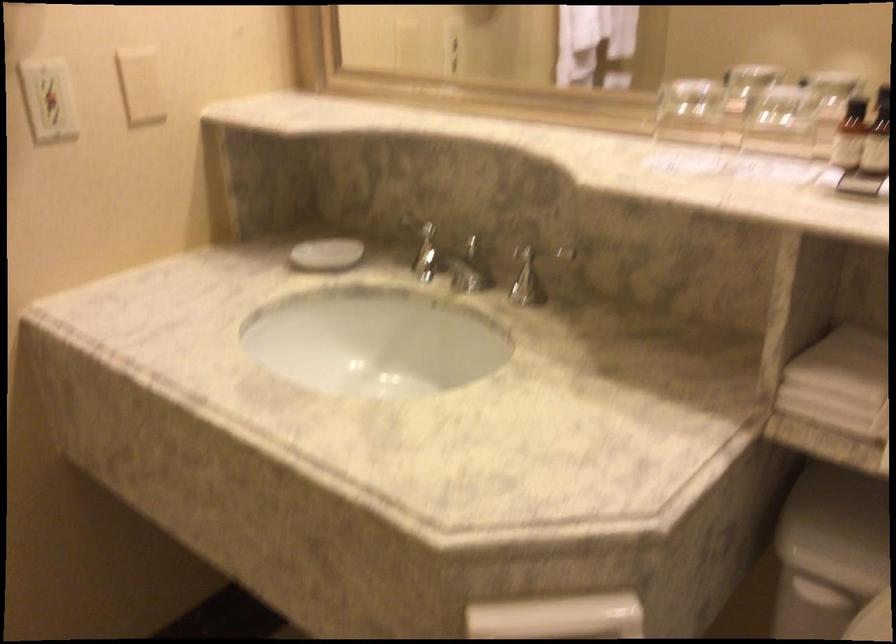
Which object does [840,383] point to?

This point indicates the stack of white towels.